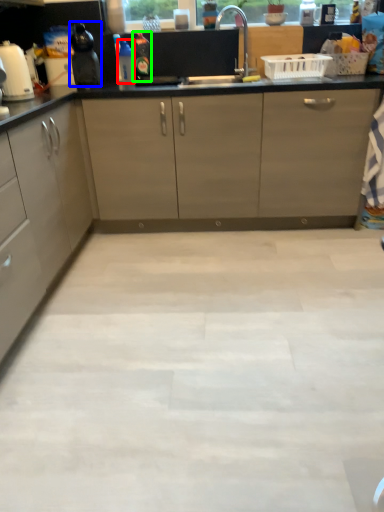
Question: Which object is positioned closest to bottle (highlighted by a red box)? Select from kitchen appliance (highlighted by a blue box) and bottle (highlighted by a green box).

Choices:
 (A) kitchen appliance
 (B) bottle

Answer: (B)